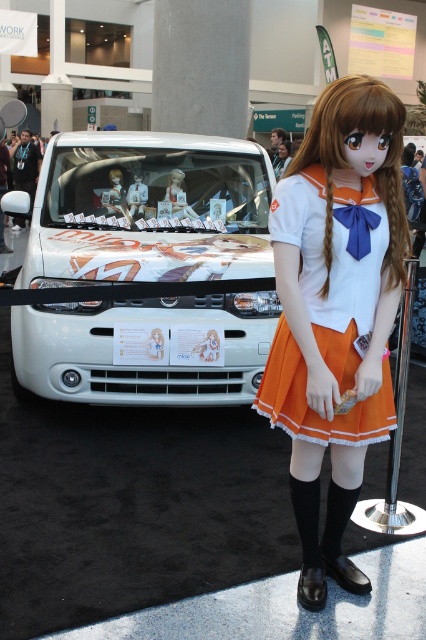
Who is positioned more to the left, white glossy car at center or orange satin dress at right?

From the viewer's perspective, white glossy car at center appears more on the left side.

Does white glossy car at center appear over orange satin dress at right?

Yes.

Who is more forward, (199,220) or (311,410)?

Point (311,410)

This screenshot has height=640, width=426. What are the coordinates of `white glossy car at center` in the screenshot? It's located at (149, 211).

Is orange satin skirt at center positioned in front of matte plastic doll at center?

That is True.

Who is lower down, orange satin skirt at center or matte plastic doll at center?

orange satin skirt at center

Where is `orange satin skirt at center`? The height and width of the screenshot is (640, 426). orange satin skirt at center is located at coordinates (336, 310).

Does orange satin dress at right appear on the right side of matte plastic doll at center?

Indeed, orange satin dress at right is positioned on the right side of matte plastic doll at center.

Between point (305, 260) and point (118, 177), which one is positioned behind?

Point (118, 177)

Where is `orange satin dress at right`? orange satin dress at right is located at coordinates (333, 260).